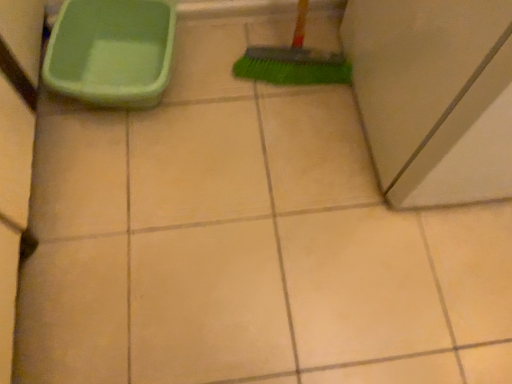
Question: Relative to green plastic bucket at upper left, is matte gray cabinet at right in front or behind?

Choices:
 (A) behind
 (B) front

Answer: (B)

Question: In the image, is matte gray cabinet at right on the left side or the right side of green plastic bucket at upper left?

Choices:
 (A) right
 (B) left

Answer: (A)

Question: In terms of size, does matte gray cabinet at right appear bigger or smaller than green plastic bucket at upper left?

Choices:
 (A) small
 (B) big

Answer: (B)

Question: Is green plastic bucket at upper left taller or shorter than matte gray cabinet at right?

Choices:
 (A) tall
 (B) short

Answer: (B)

Question: Considering their positions, is green plastic bucket at upper left located in front of or behind matte gray cabinet at right?

Choices:
 (A) behind
 (B) front

Answer: (A)

Question: From a real-world perspective, is green plastic bucket at upper left physically located above or below matte gray cabinet at right?

Choices:
 (A) below
 (B) above

Answer: (A)

Question: From the image's perspective, is green plastic bucket at upper left positioned above or below matte gray cabinet at right?

Choices:
 (A) above
 (B) below

Answer: (B)